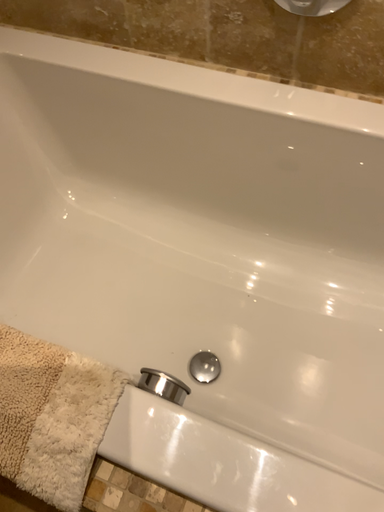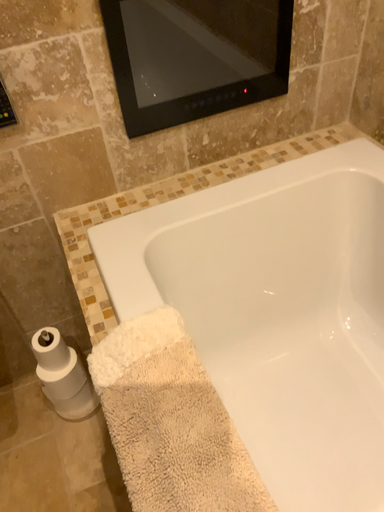
Question: Which way did the camera rotate in the video?

Choices:
 (A) rotated left
 (B) rotated right

Answer: (A)